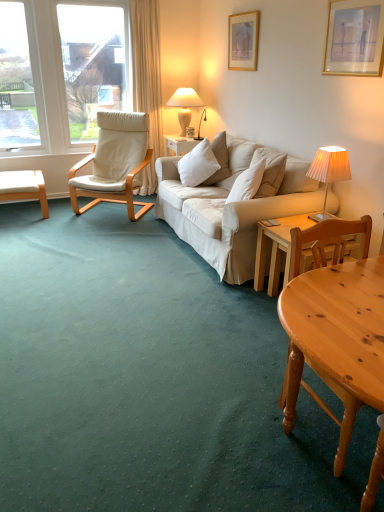
You are a GUI agent. You are given a task and a screenshot of the screen. Output one action in this format:
    pyautogui.click(x=<x>, y=<y>)
    Task: Click on the vacant area to the left of light brown wooden table at lower right
    
    Given the screenshot: What is the action you would take?
    pyautogui.click(x=247, y=439)